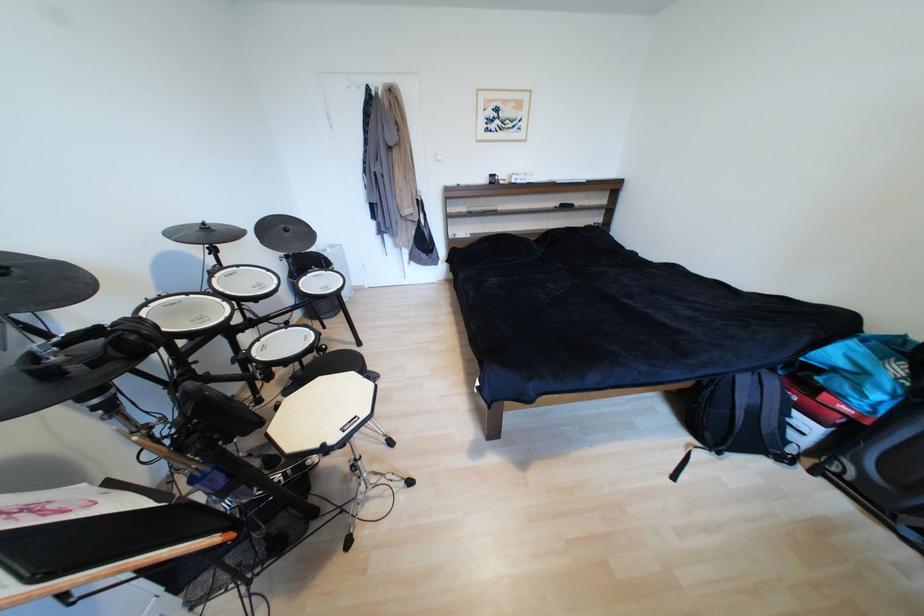
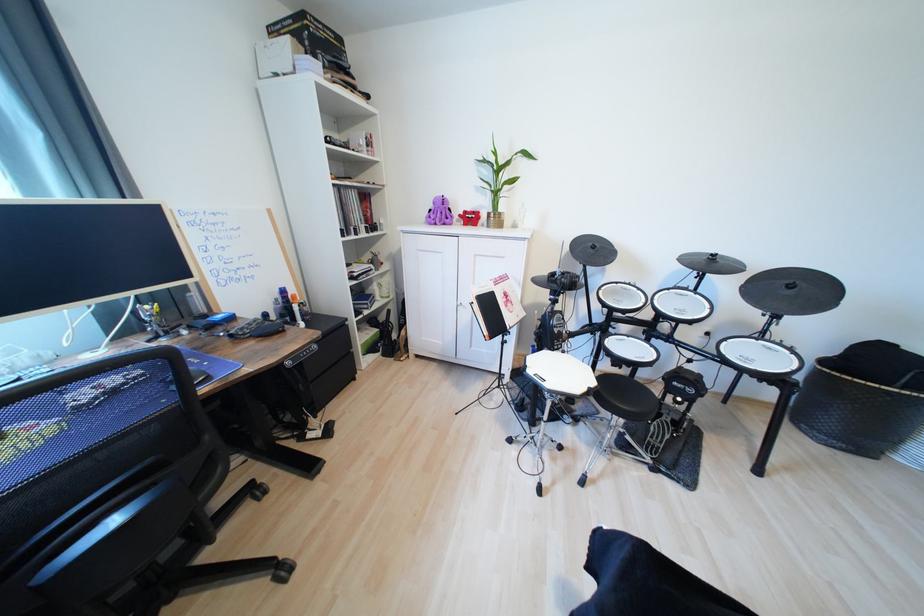
Locate, in the second image, the point that corresponds to (211,225) in the first image.

(721, 257)